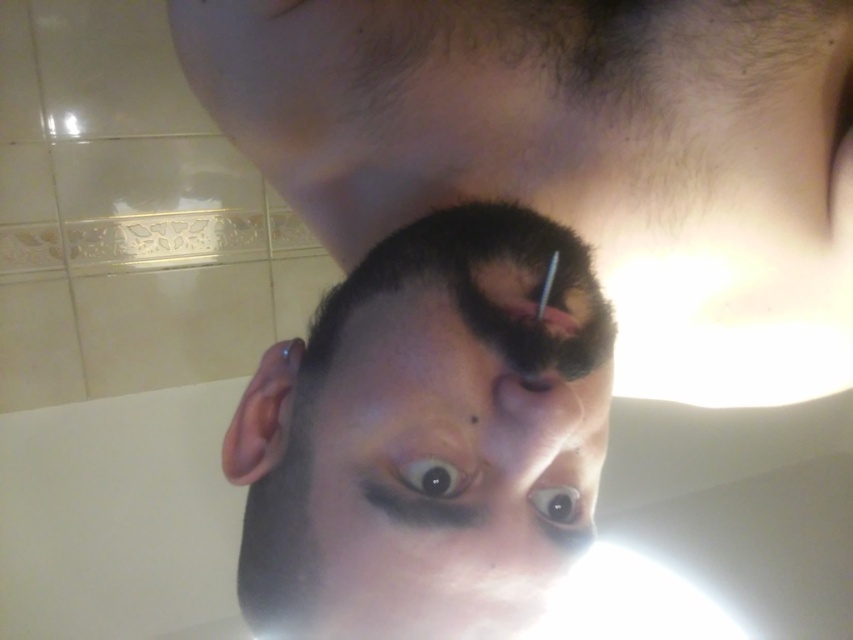
Question: Can you confirm if smooth skin at center is positioned to the left of black glossy eye at center?

Choices:
 (A) yes
 (B) no

Answer: (A)

Question: Is dark brown hair at center closer to the viewer compared to black glossy eye at center?

Choices:
 (A) yes
 (B) no

Answer: (A)

Question: Considering the real-world distances, which object is farthest from the black glossy eye at center?

Choices:
 (A) shiny black hair at center
 (B) brown glossy eye at center
 (C) dark brown hair at center
 (D) smooth skin at center

Answer: (A)

Question: Observing the image, what is the correct spatial positioning of black glossy eye at center in reference to brown glossy eye at center?

Choices:
 (A) below
 (B) above

Answer: (B)

Question: Which point is closer to the camera taking this photo?

Choices:
 (A) (399, 499)
 (B) (408, 300)
 (C) (364, 332)

Answer: (A)

Question: Which is nearer to the smooth skin at center?

Choices:
 (A) black glossy eye at center
 (B) dark brown hair at center
 (C) brown glossy eye at center
 (D) shiny black hair at center

Answer: (D)